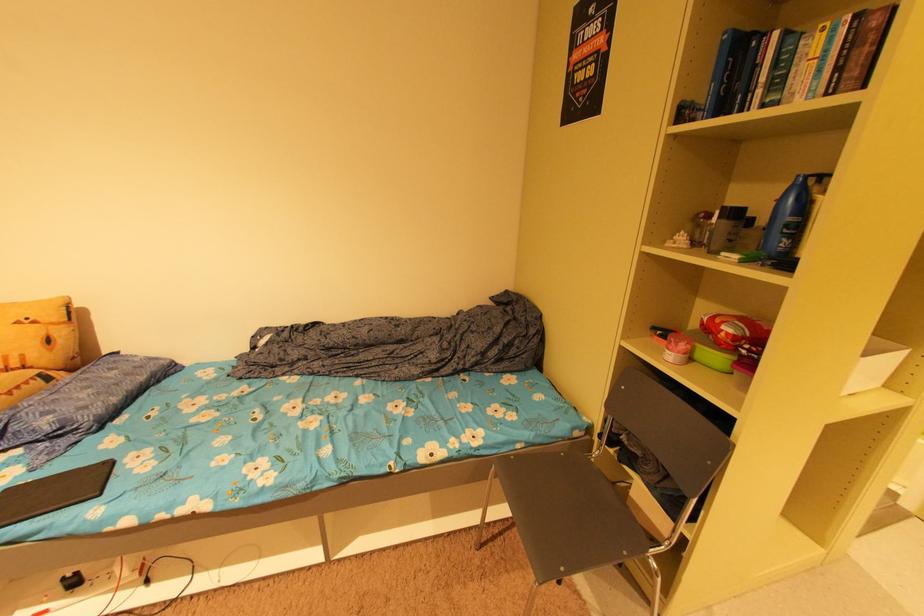
The image size is (924, 616). Identify the location of chair sitting surface. (567, 514).